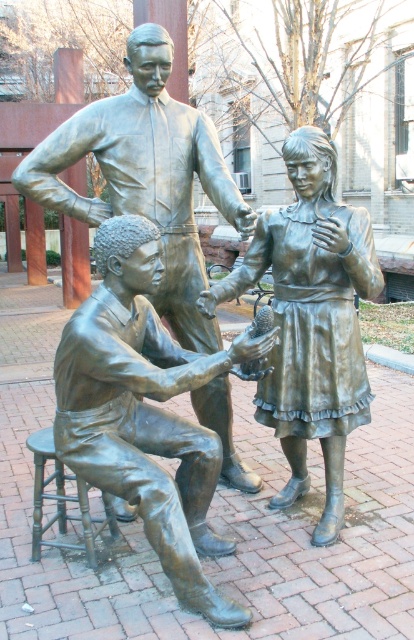
Does bronze statue of girl at center have a greater width compared to bronze statue at center?

No.

Is point (331, 362) positioned behind point (48, 134)?

No, (331, 362) is in front of (48, 134).

Identify the location of bronze statue of girl at center. (312, 321).

Can you confirm if bronze statue at lower left is positioned below bronze statue of girl at center?

Indeed, bronze statue at lower left is positioned under bronze statue of girl at center.

Between bronze statue at lower left and bronze statue of girl at center, which one appears on the right side from the viewer's perspective?

Positioned to the right is bronze statue of girl at center.

The height and width of the screenshot is (640, 414). What do you see at coordinates (144, 412) in the screenshot? I see `bronze statue at lower left` at bounding box center [144, 412].

What are the coordinates of `bronze statue at lower left` in the screenshot? It's located at (144, 412).

Measure the distance between point [322,276] and camera.

Point [322,276] is 3.45 meters away from camera.

Who is taller, bronze statue of girl at center or bronze stool at lower left?

bronze statue of girl at center

Between point (295, 268) and point (57, 483), which one is positioned behind?

The point (57, 483) is more distant.

I want to click on bronze statue of girl at center, so click(x=312, y=321).